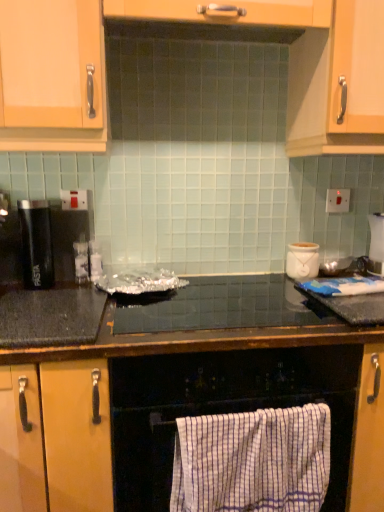
Find the location of a particular element. Image resolution: width=384 pixels, height=512 pixels. empty space that is ontop of white striped towel at lower center is located at coordinates (255, 408).